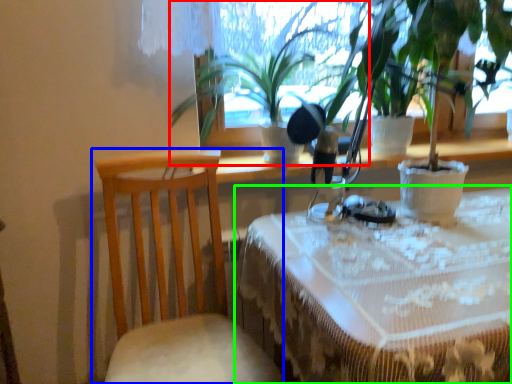
Question: Estimate the real-world distances between objects in this image. Which object is closer to houseplant (highlighted by a red box), chair (highlighted by a blue box) or table (highlighted by a green box)?

Choices:
 (A) chair
 (B) table

Answer: (A)